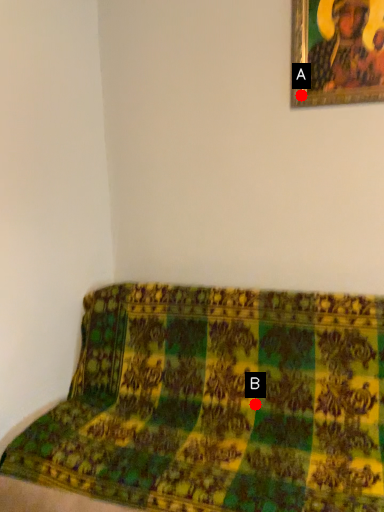
Question: Two points are circled on the image, labeled by A and B beside each circle. Which point appears farthest from the camera in this image?

Choices:
 (A) A is further
 (B) B is further

Answer: (A)